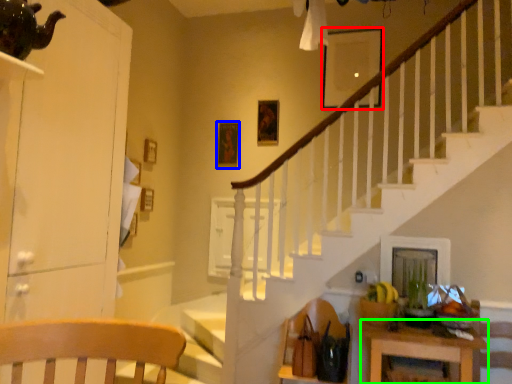
Question: Estimate the real-world distances between objects in this image. Which object is closer to picture frame (highlighted by a red box), picture frame (highlighted by a blue box) or table (highlighted by a green box)?

Choices:
 (A) picture frame
 (B) table

Answer: (A)